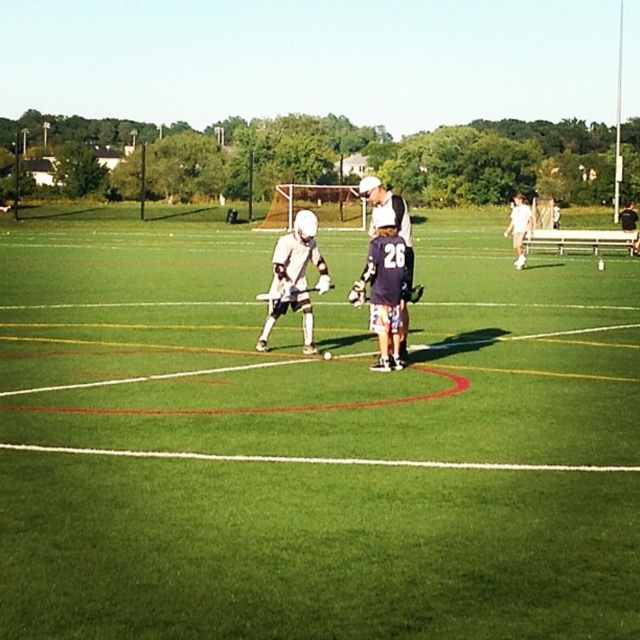
Question: Does white matte lacrosse stick at center have a smaller size compared to dark blue jersey at center?

Choices:
 (A) yes
 (B) no

Answer: (A)

Question: Which of these objects is positioned closest to the dark blue jersey at center?

Choices:
 (A) white matte uniform at center
 (B) green grass field at center
 (C) white matte lacrosse stick at center

Answer: (C)

Question: Which point is closer to the camera?

Choices:
 (A) green grass field at center
 (B) dark blue jersey at center
 (C) white matte uniform at center
 (D) white matte lacrosse stick at center

Answer: (A)

Question: Which of the following is the farthest from the observer?

Choices:
 (A) (285, 284)
 (B) (516, 250)
 (C) (58, 483)
 (D) (358, 182)

Answer: (D)

Question: From the image, what is the correct spatial relationship of dark blue jersey at center in relation to white matte uniform at center?

Choices:
 (A) above
 (B) below

Answer: (A)

Question: From the image, what is the correct spatial relationship of white matte lacrosse stick at center in relation to white matte uniform at center?

Choices:
 (A) below
 (B) above

Answer: (A)